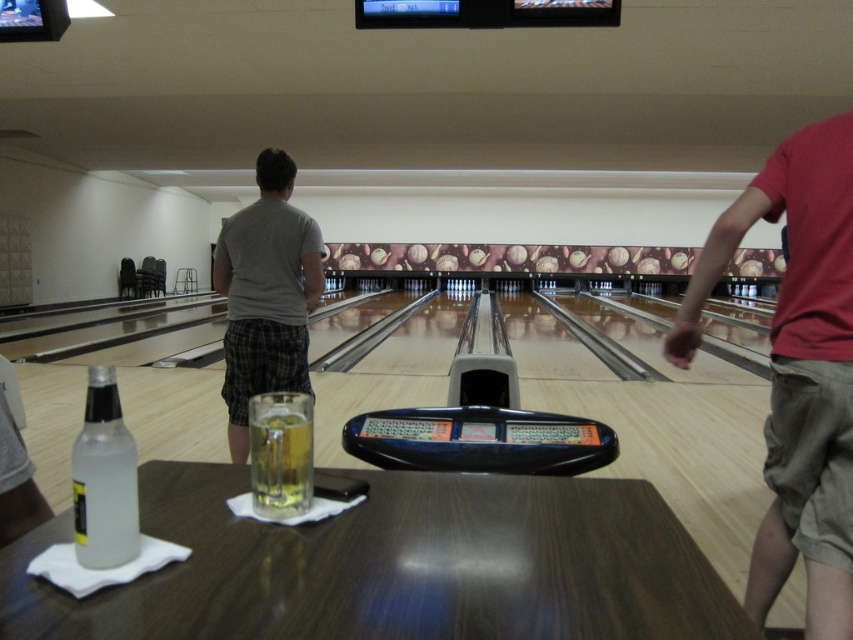
Question: Which point is closer to the camera?

Choices:
 (A) red cotton shirt at right
 (B) gray cotton t-shirt at center
 (C) clear glass bottle at table left

Answer: (C)

Question: Does red cotton shirt at right have a smaller size compared to clear glass bottle at table left?

Choices:
 (A) yes
 (B) no

Answer: (B)

Question: Is wooden table at center bigger than translucent glass mug at center?

Choices:
 (A) no
 (B) yes

Answer: (B)

Question: From the image, what is the correct spatial relationship of clear glass bottle at table left in relation to translucent glass mug at center?

Choices:
 (A) above
 (B) below

Answer: (A)

Question: Which point is farther to the camera?

Choices:
 (A) (97, 426)
 (B) (259, 157)
 (C) (428, 483)

Answer: (B)

Question: Which object is positioned closest to the red cotton shirt at right?

Choices:
 (A) gray cotton t-shirt at center
 (B) wooden table at center

Answer: (B)